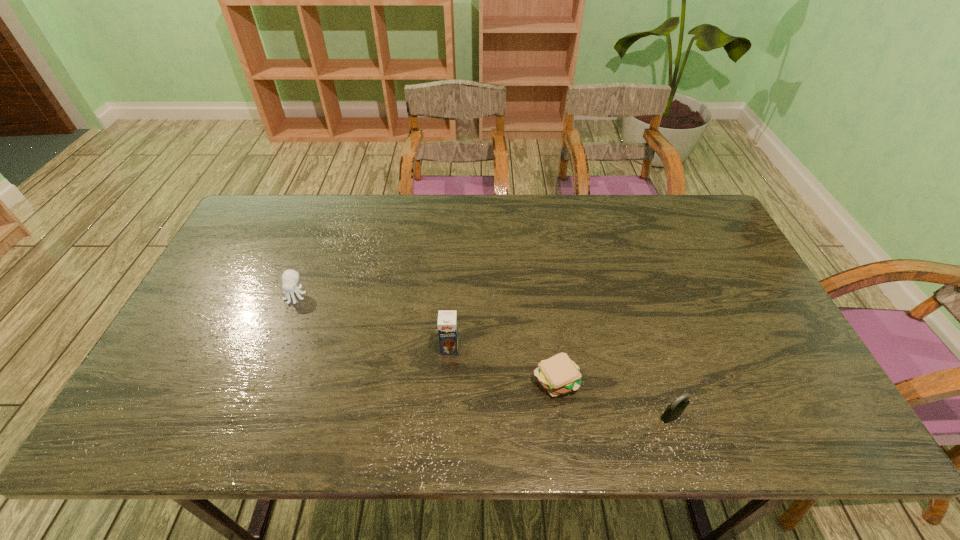
You are a GUI agent. You are given a task and a screenshot of the screen. Output one action in this format:
    pyautogui.click(x=<x>, y=<y>)
    Task: Click on the chocolate milk
    This screenshot has width=960, height=540.
    Given the screenshot: What is the action you would take?
    pyautogui.click(x=447, y=320)

Where is `the second farthest object`? the second farthest object is located at coordinates coord(447,320).

Locate an element on the screen. The height and width of the screenshot is (540, 960). padlock is located at coordinates (674, 410).

I want to click on the nearest object, so click(674, 410).

I want to click on the farthest object, so click(x=290, y=278).

Identify the location of the leftmost object. The height and width of the screenshot is (540, 960). (290, 278).

What are the coordinates of `the shortest object` in the screenshot? It's located at (559, 374).

The width and height of the screenshot is (960, 540). In order to click on the second nearest object in this screenshot , I will do pos(559,374).

Identify the location of vacant position located 0.100m on the front label of the chocolate milk. (447, 390).

The height and width of the screenshot is (540, 960). What are the coordinates of `vacant space located on the back of the nearest object` in the screenshot? It's located at (640, 320).